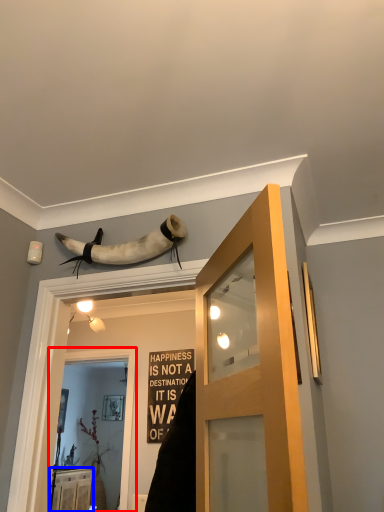
Question: Which object is further to the camera taking this photo, screen door (highlighted by a red box) or cabinetry (highlighted by a blue box)?

Choices:
 (A) screen door
 (B) cabinetry

Answer: (B)